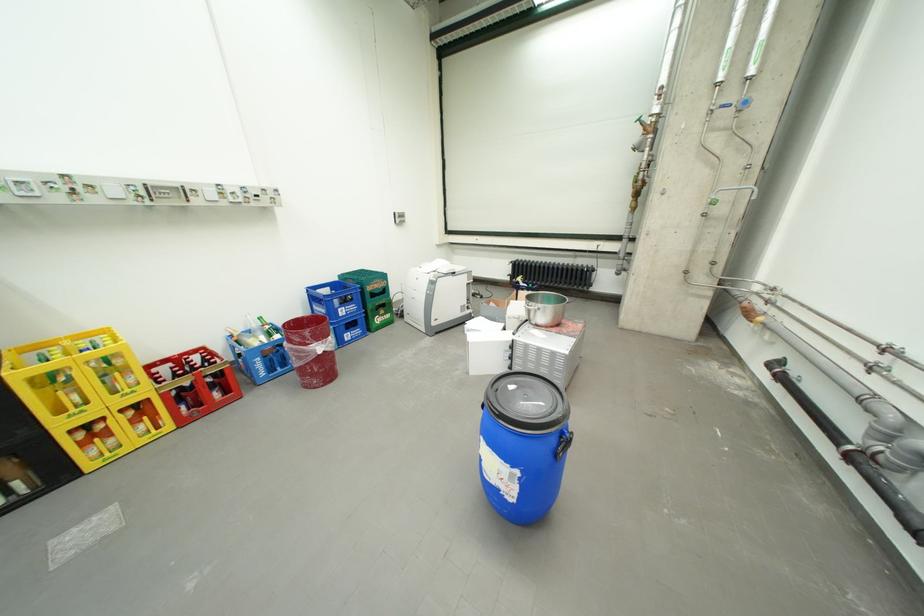
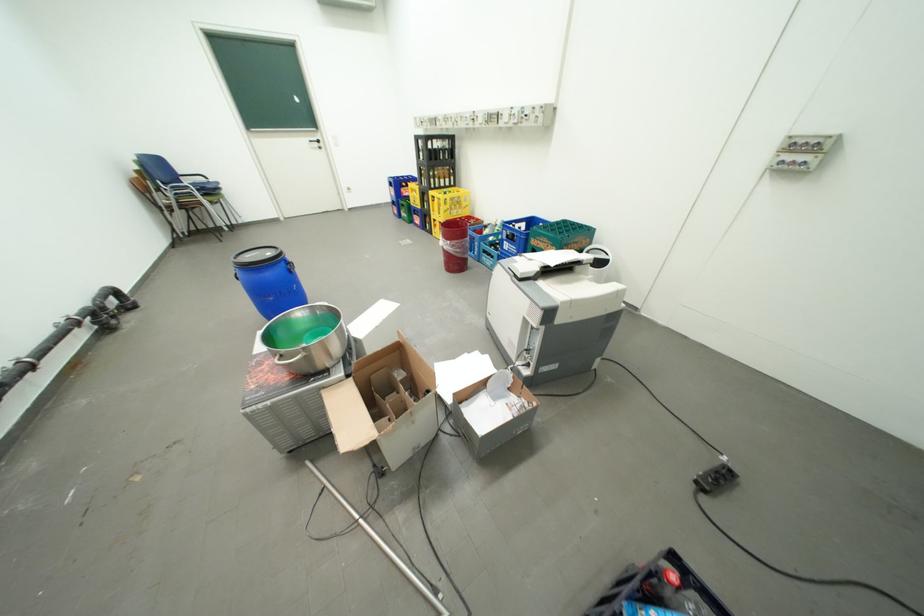
Where in the second image is the point corresponding to the point at 339,339 from the first image?

(459, 243)